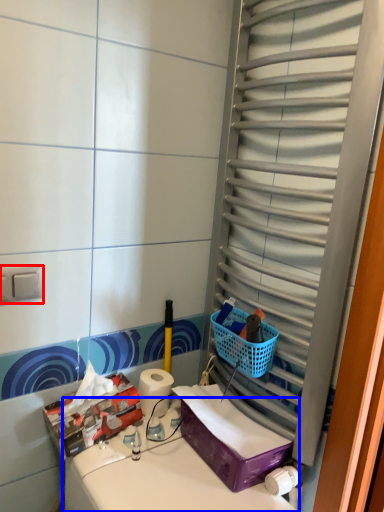
Question: Among these objects, which one is farthest to the camera, electric outlet (highlighted by a red box) or counter top (highlighted by a blue box)?

Choices:
 (A) electric outlet
 (B) counter top

Answer: (A)